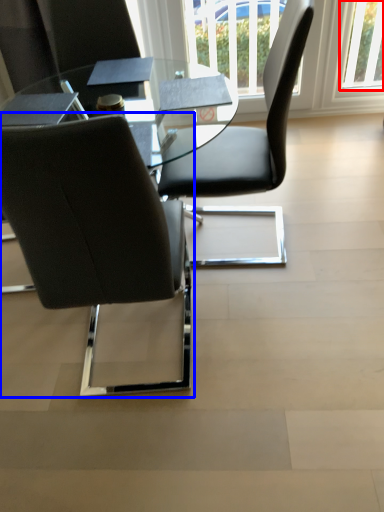
Question: Which point is further to the camera, window (highlighted by a red box) or chair (highlighted by a blue box)?

Choices:
 (A) window
 (B) chair

Answer: (A)